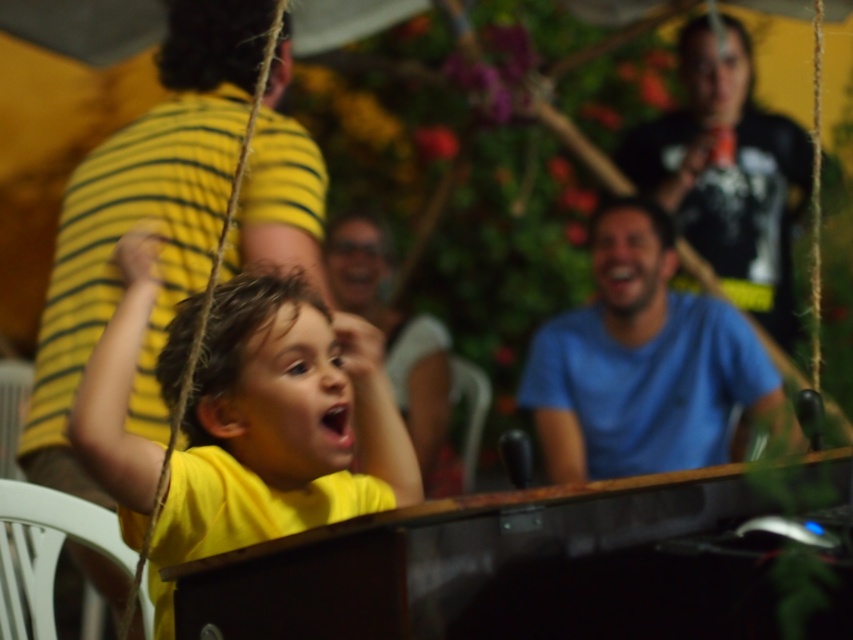
You are standing at the position of point (379, 291) and want to move towards point (300, 451). Is there a clear path between these two points without any obstacles?

Yes, there is a clear path between point (300, 451) and point (379, 291) since point (300, 451) is in front of point (379, 291), indicating no obstruction between them.

You are organizing a group photo and want to arrange the blue cotton shirt at center and the matte yellow shirt at center side by side. Based on their sizes, which shirt should be placed on the left to ensure they fit within a 1.2 meter wide frame?

The blue cotton shirt at center is wider than the matte yellow shirt at center. To fit within the 1.2 meter wide frame, place the narrower matte yellow shirt at center on the left and the wider blue cotton shirt at center on the right, ensuring their combined width does not exceed the frame.

You are standing at the center of the image and want to hand a gift to the blue cotton shirt at center. In which direction should you move to reach their location?

The blue cotton shirt at center is already at the center of the image, so you don not need to move in any direction to reach them.